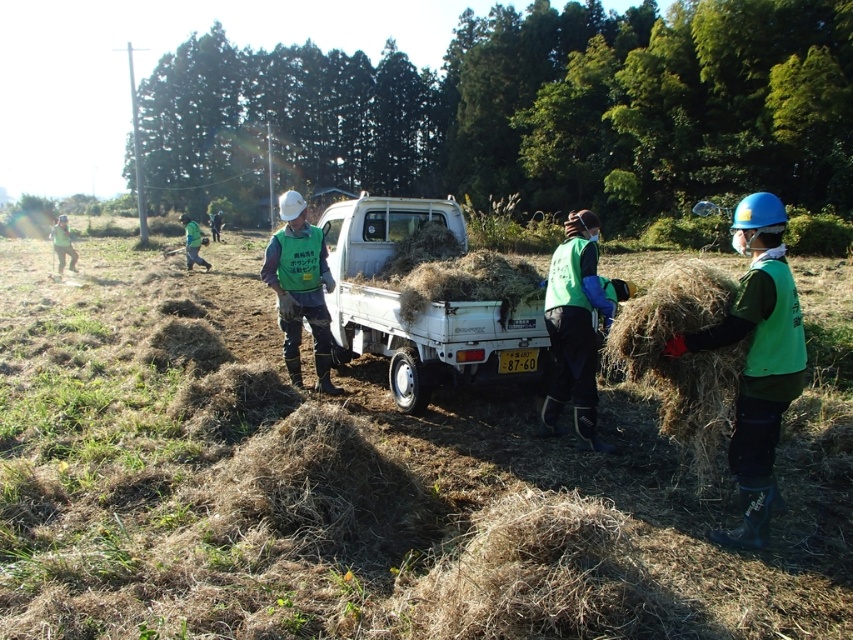
Who is taller, brown dry hay at right or green fabric vest at left?

green fabric vest at left

Does brown dry hay at right have a lesser width compared to green fabric vest at left?

Indeed, brown dry hay at right has a lesser width compared to green fabric vest at left.

In order to click on brown dry hay at right in this screenshot , I will do `click(680, 358)`.